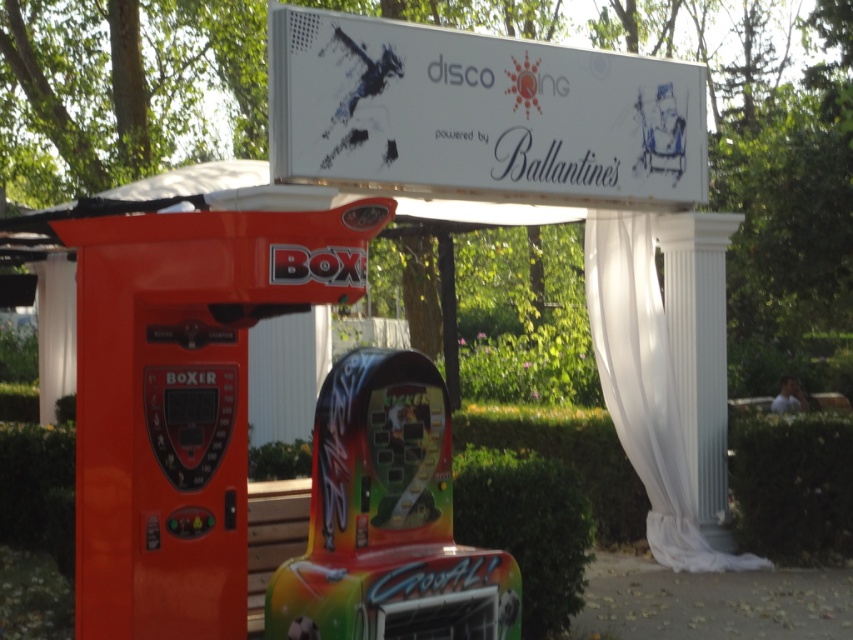
You are standing in front of the shiny plastic arcade machine at center and want to read the white glossy sign at upper center. In which direction should you turn your head?

The white glossy sign at upper center is to the right of the shiny plastic arcade machine at center, so you should turn your head to the right to read it.

You are standing in front of the arcade machines under the canopy. There are two points marked in the scene. The first point is at coordinates point [299,131] and the second is at point [473,557]. Which point is closer to you?

Point [299,131] is closer to you because it is further to the viewer than point [473,557].

You are at a promotional event and want to take a photo with the white sheer curtain at center and the white marble column at center. Which object will appear larger in the photo if you focus on them equally?

The white sheer curtain at center will appear larger in the photo because it is much taller than the white marble column at center.